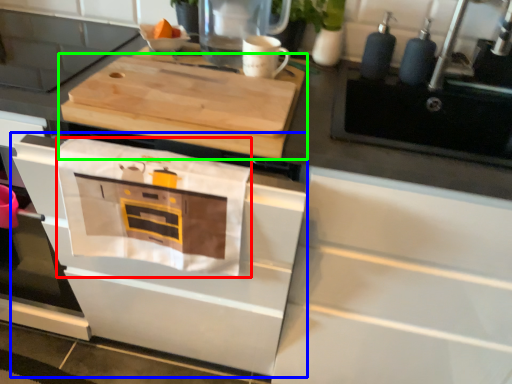
Question: Which is nearer to the cloth (highlighted by a red box)? oven (highlighted by a blue box) or cutting board (highlighted by a green box).

Choices:
 (A) oven
 (B) cutting board

Answer: (A)